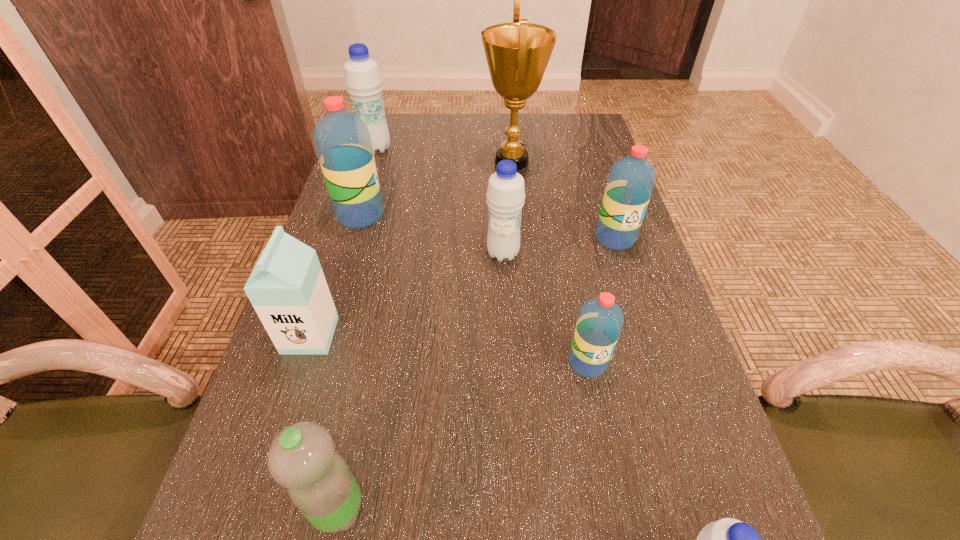
Image resolution: width=960 pixels, height=540 pixels. In the image, there is a desktop. In order to click on vacant region at the far right corner in this screenshot , I will do `click(562, 127)`.

Image resolution: width=960 pixels, height=540 pixels. In order to click on vacant space that's between the leftmost red water bottle and the green water bottle in this screenshot , I will do `click(349, 362)`.

Where is `blank region between the white milk carton and the biggest blue water bottle`? The width and height of the screenshot is (960, 540). blank region between the white milk carton and the biggest blue water bottle is located at coordinates (343, 242).

I want to click on empty space that is in between the farthest blue water bottle and the gold award, so click(444, 155).

This screenshot has height=540, width=960. Find the location of `vacant space in between the white milk carton and the tallest object`. vacant space in between the white milk carton and the tallest object is located at coordinates (411, 248).

The width and height of the screenshot is (960, 540). I want to click on free space between the second biggest red water bottle and the second blue water bottle from right to left, so click(559, 246).

This screenshot has height=540, width=960. In order to click on empty space between the fourth water bottle from left to right and the leftmost red water bottle in this screenshot , I will do `click(432, 234)`.

At what (x,y) coordinates should I click in order to perform the action: click on vacant area between the leftmost blue water bottle and the second blue water bottle from left to right. Please return your answer as a coordinate pair (x, y). Image resolution: width=960 pixels, height=540 pixels. Looking at the image, I should click on (440, 201).

Choose which object is the second nearest neighbor to the leftmost red water bottle. Please provide its 2D coordinates. Your answer should be formatted as a tuple, i.e. [(x, y)], where the tuple contains the x and y coordinates of a point satisfying the conditions above.

[(517, 53)]

Where is `the fifth closest object to the leftmost blue water bottle`? Image resolution: width=960 pixels, height=540 pixels. the fifth closest object to the leftmost blue water bottle is located at coordinates (631, 179).